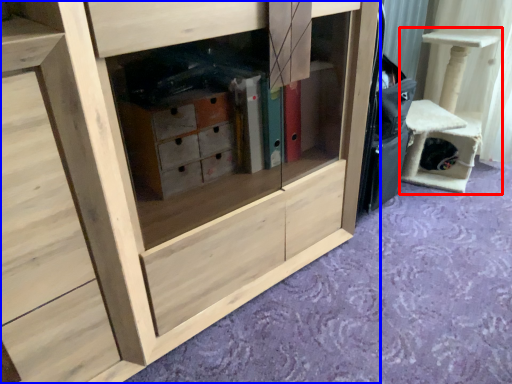
Question: Which object is closer to the camera taking this photo, furniture (highlighted by a red box) or cabinetry (highlighted by a blue box)?

Choices:
 (A) furniture
 (B) cabinetry

Answer: (B)